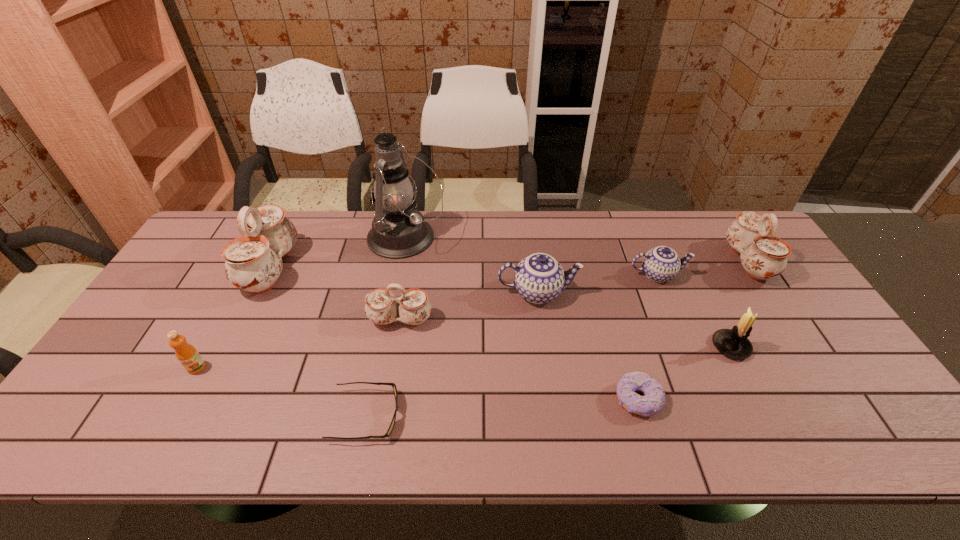
Where is `vacant area situated by the handle of the second tallest chinaware`? vacant area situated by the handle of the second tallest chinaware is located at coordinates (666, 261).

This screenshot has width=960, height=540. Find the location of `free spot located 0.290m on the back of the candle holder`. free spot located 0.290m on the back of the candle holder is located at coordinates (687, 261).

The width and height of the screenshot is (960, 540). I want to click on free location located 0.050m at the spout of the fifth object from right to left, so click(595, 293).

I want to click on vacant space located by the handle of the nearest white chinaware, so click(384, 417).

Image resolution: width=960 pixels, height=540 pixels. I want to click on free location located 0.130m on the front label of the orange juice, so [x=166, y=423].

Find the location of a particular element. vacant region located 0.080m at the spout of the right blue chinaware is located at coordinates (712, 275).

Where is `vacant space located 0.370m on the left of the ninth tallest object`? vacant space located 0.370m on the left of the ninth tallest object is located at coordinates (460, 400).

The width and height of the screenshot is (960, 540). Identify the location of free spot located 0.240m on the front-facing side of the sunglasses. (503, 416).

Where is `oil lamp situated at the far edge`? oil lamp situated at the far edge is located at coordinates (399, 231).

This screenshot has width=960, height=540. Find the location of `doughnut that is at the near edge`. doughnut that is at the near edge is located at coordinates (650, 404).